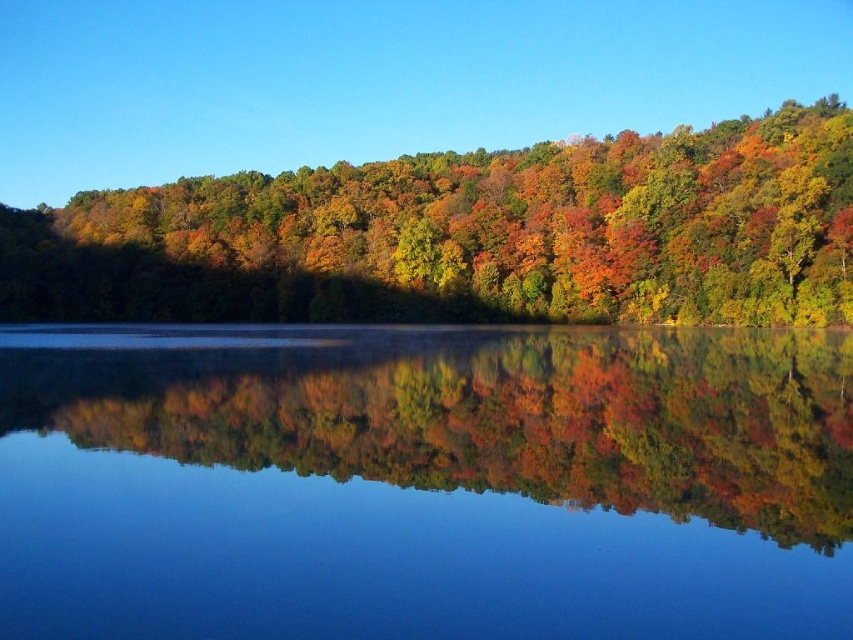
Question: Can you confirm if smooth glass water at center is positioned below autumn leaves at center?

Choices:
 (A) no
 (B) yes

Answer: (B)

Question: Which of the following is the farthest from the observer?

Choices:
 (A) smooth glass water at center
 (B) autumn leaves at center

Answer: (B)

Question: Can you confirm if smooth glass water at center is positioned above autumn leaves at center?

Choices:
 (A) yes
 (B) no

Answer: (B)

Question: Is smooth glass water at center to the left of autumn leaves at center from the viewer's perspective?

Choices:
 (A) yes
 (B) no

Answer: (B)

Question: Which of the following is the farthest from the observer?

Choices:
 (A) (467, 364)
 (B) (265, 220)

Answer: (B)